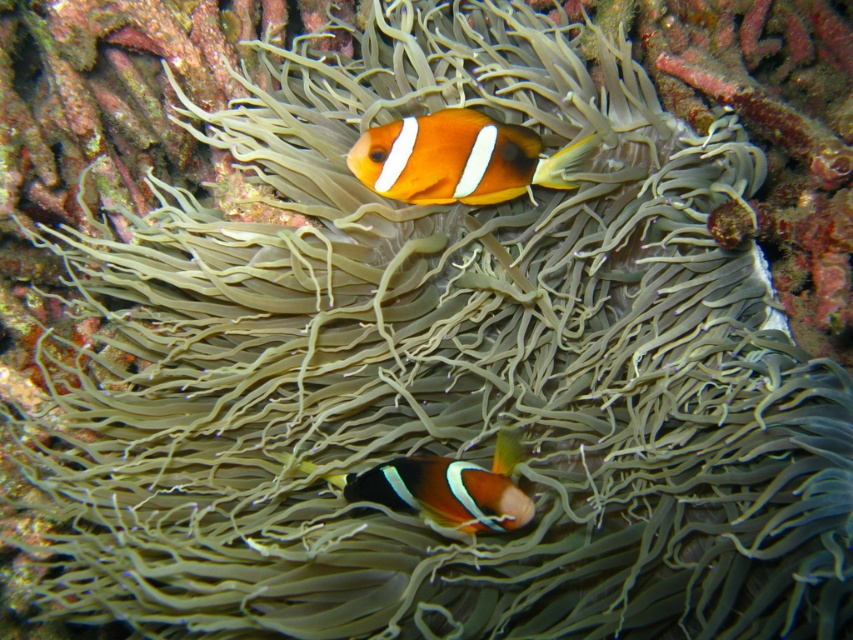
In the scene shown: You are a marine biologist observing an underwater scene. You notice a point at coordinates (459, 157). Based on the scene description, what object is located at that point?

The point at coordinates (459, 157) indicates the orange matte clownfish at upper center.

Based on the photo, you are a diver observing two orange matte clownfish in an underwater scene. The scene includes a sea anemone with many tentacles. Which clownfish is positioned to the right when looking at the orange matte clownfish at upper center and the orange matte clownfish at center?

The orange matte clownfish at upper center is positioned to the right of the orange matte clownfish at center.

You are a marine biologist observing this underwater scene. You need to place a 18 inch measuring tape between the two orange matte clownfish. Will the measuring tape be long enough to reach both ends from the orange matte clownfish at upper center to the orange matte clownfish at center?

The distance between the orange matte clownfish at upper center and the orange matte clownfish at center is 17.91 inches. Since the measuring tape is 18 inches long, it will be long enough to reach both ends between them.